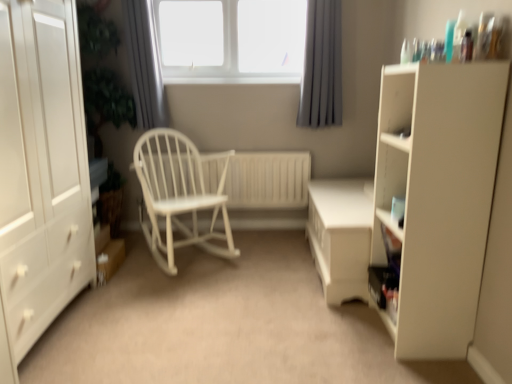
In order to click on vacant space in front of white glossy table at center in this screenshot , I will do `click(313, 327)`.